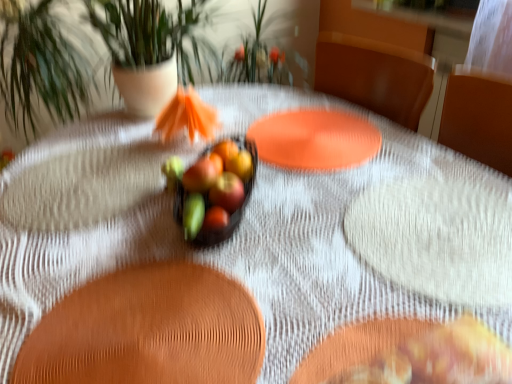
Find the location of a particular element. vacant space in front of green matte apple at center, acting as the 2th fruit starting from the top is located at coordinates (152, 236).